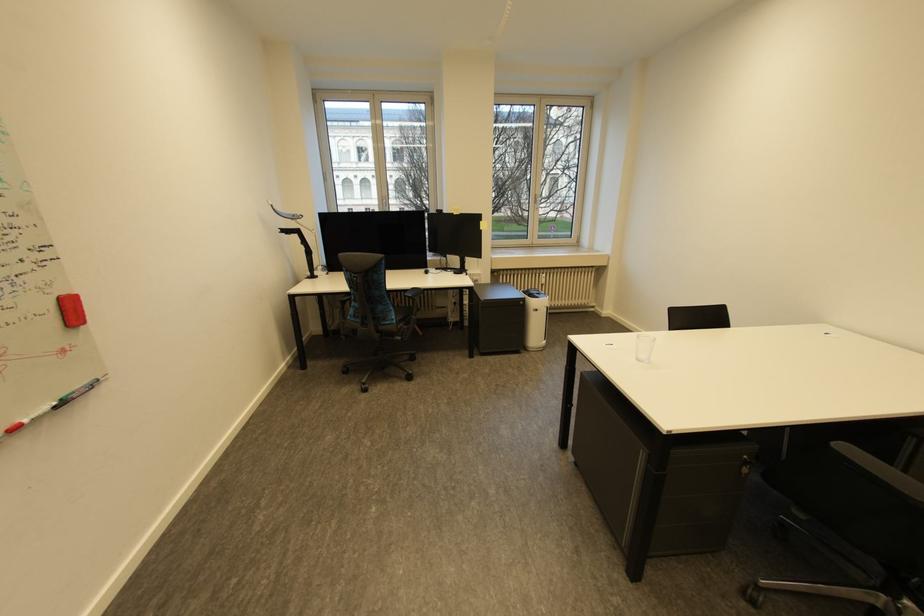
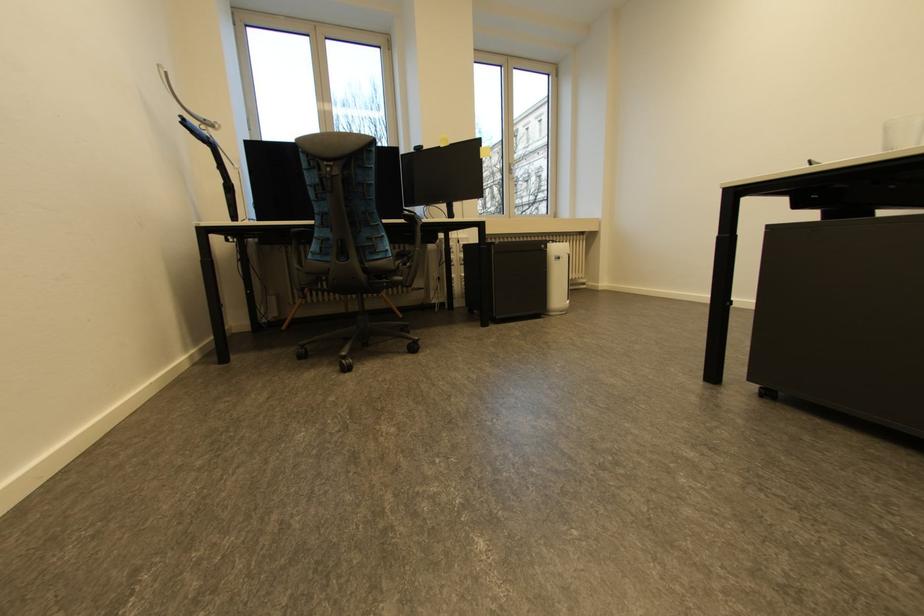
The images are taken continuously from a first-person perspective. In which direction are you moving?

The cameraman walked toward left, forward.